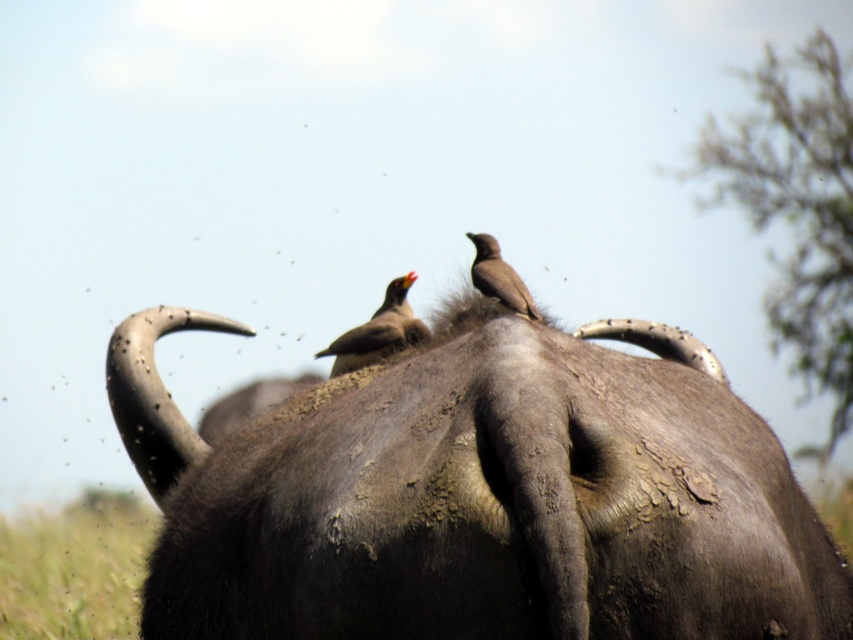
Between dark gray textured hide at center and green grass at bottom left, which one has less height?

green grass at bottom left is shorter.

Which is above, dark gray textured hide at center or green grass at bottom left?

dark gray textured hide at center is higher up.

This screenshot has height=640, width=853. I want to click on dark gray textured hide at center, so coord(479,497).

Which is in front, point (343, 371) or point (466, 236)?

Positioned in front is point (466, 236).

Does brown feathered bird at center appear over brown matte bird at center?

Incorrect, brown feathered bird at center is not positioned above brown matte bird at center.

Between point (404, 278) and point (498, 256), which one is positioned in front?

Point (498, 256)

Find the location of `brown feathered bird at center`. brown feathered bird at center is located at coordinates (378, 332).

Is green grass at bottom left smaller than brown feathered bird at center?

Incorrect, green grass at bottom left is not smaller in size than brown feathered bird at center.

Where is `green grass at bottom left`? Image resolution: width=853 pixels, height=640 pixels. green grass at bottom left is located at coordinates click(73, 572).

I want to click on green grass at bottom left, so click(73, 572).

Image resolution: width=853 pixels, height=640 pixels. I want to click on green grass at bottom left, so click(73, 572).